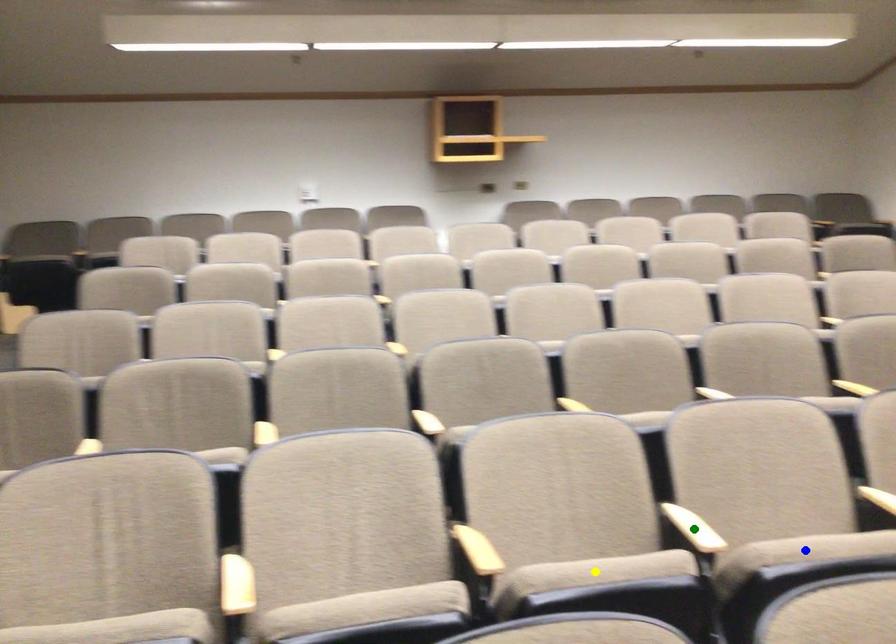
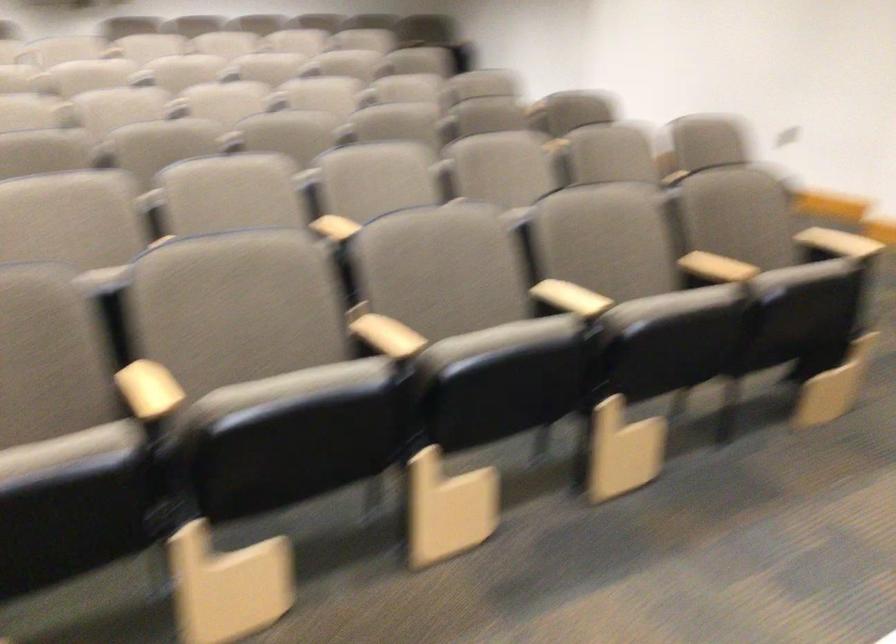
I am providing you with two images of the same scene from different viewpoints. Three points are marked in image1. Which point corresponds to a part or object that is occluded in image2?In image1, three points are marked. Which of them correspond to a part or object that is occluded in image2?Among the three points shown in image1, which one corresponds to a part or object that is no longer visible due to occlusion in image2?

blue point, yellow point, green point cannot be seen in image2.